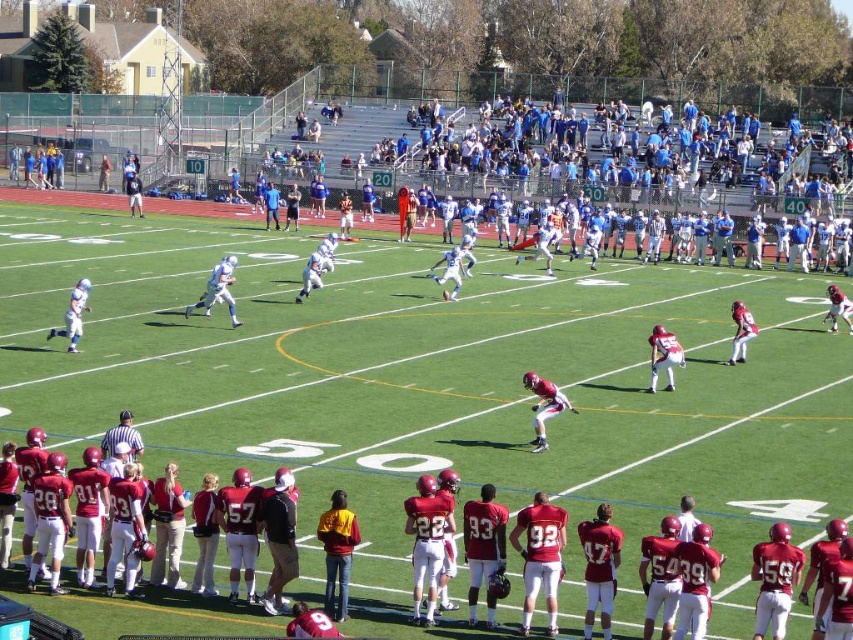
Does matte white uniform at center have a larger size compared to matte white uniform at left?

Indeed, matte white uniform at center has a larger size compared to matte white uniform at left.

Describe the element at coordinates (218, 289) in the screenshot. The height and width of the screenshot is (640, 853). I see `matte white uniform at center` at that location.

Is point (230, 266) positioned in front of point (48, 337)?

No, (230, 266) is behind (48, 337).

Where is `matte white uniform at center`? The width and height of the screenshot is (853, 640). matte white uniform at center is located at coordinates (218, 289).

Between shiny red football player at center and shiny red helmet at center, which one has more height?

shiny red football player at center is taller.

The width and height of the screenshot is (853, 640). I want to click on shiny red football player at center, so click(544, 404).

Who is positioned more to the right, shiny red helmet at center or matte white uniform at left?

Positioned to the right is shiny red helmet at center.

What are the coordinates of `shiny red helmet at center` in the screenshot? It's located at (663, 356).

This screenshot has height=640, width=853. In order to click on shiny red helmet at center in this screenshot , I will do `click(663, 356)`.